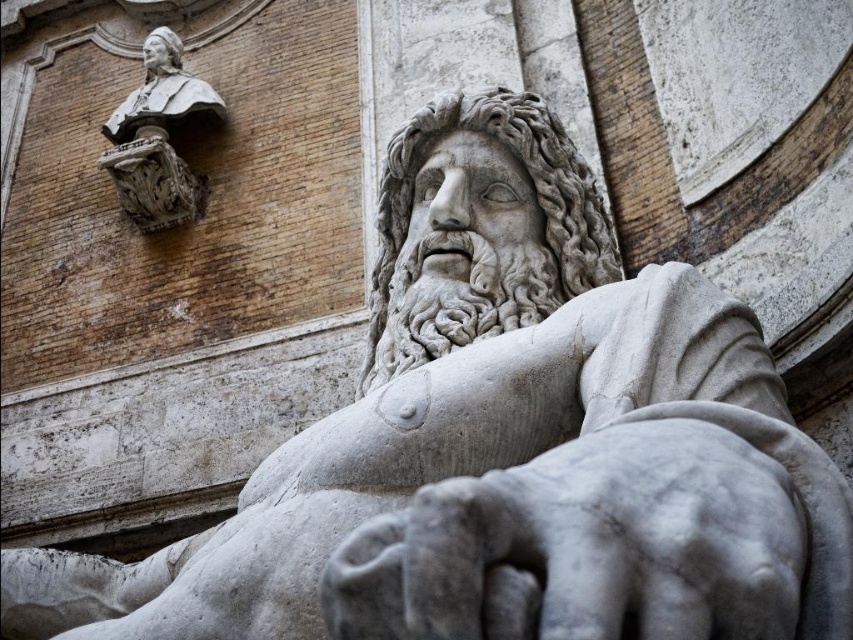
You are an art conservator examining the statue and its surroundings. You notice the gray stone hand at lower center and the matte stone bust at upper left. Which object is positioned higher up in the image?

The matte stone bust at upper left is positioned higher up in the image than the gray stone hand at lower center.

You are an art conservator examining the statue and its surroundings. You notice the gray stone hand at lower center and the matte stone bust at upper left. Which object has a greater width?

The gray stone hand at lower center might be wider than matte stone bust at upper left.